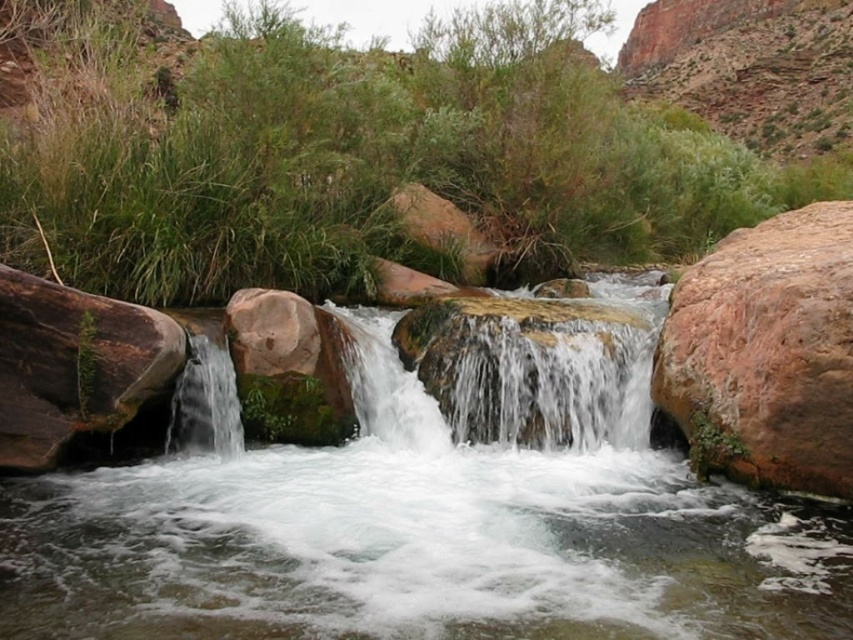
Which is more to the right, clear water at center or rusty stone boulder at right?

From the viewer's perspective, rusty stone boulder at right appears more on the right side.

Between point (509, 541) and point (705, 316), which one is positioned in front?

Point (509, 541)

Where is `clear water at center`? This screenshot has width=853, height=640. clear water at center is located at coordinates (419, 536).

Between point (778, 483) and point (199, 372), which one is positioned in front?

Point (778, 483) is more forward.

Measure the distance between rusty stone boulder at right and clear water at left.

rusty stone boulder at right is 16.36 feet away from clear water at left.

This screenshot has width=853, height=640. Describe the element at coordinates (764, 353) in the screenshot. I see `rusty stone boulder at right` at that location.

This screenshot has height=640, width=853. Identify the location of rusty stone boulder at right. (764, 353).

Who is higher up, green grass at upper center or rusty stone boulder at right?

green grass at upper center is higher up.

Can you confirm if green grass at upper center is positioned to the right of rusty stone boulder at right?

Indeed, green grass at upper center is positioned on the right side of rusty stone boulder at right.

The height and width of the screenshot is (640, 853). In order to click on green grass at upper center in this screenshot , I will do `click(352, 156)`.